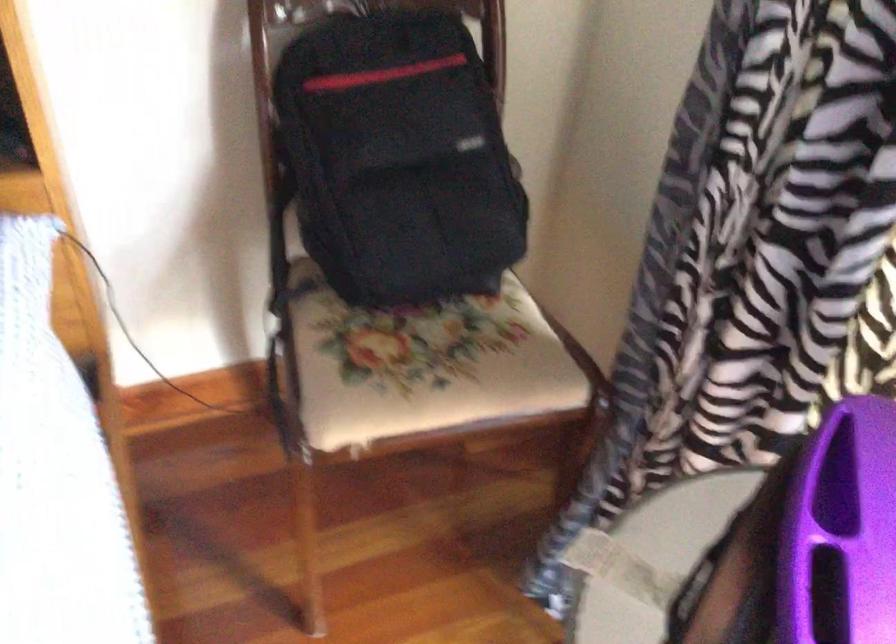
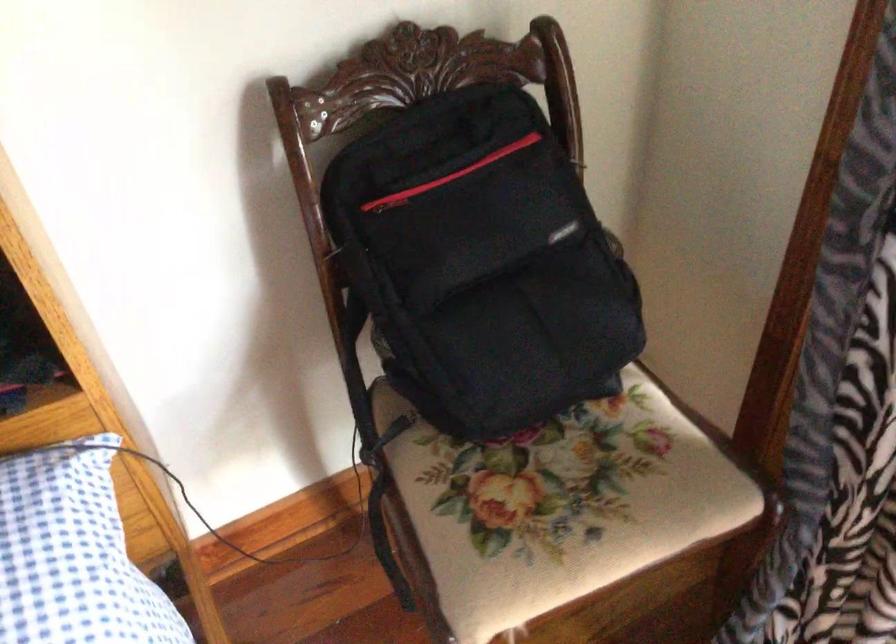
The point at (328, 89) is marked in the first image. Where is the corresponding point in the second image?

(389, 202)